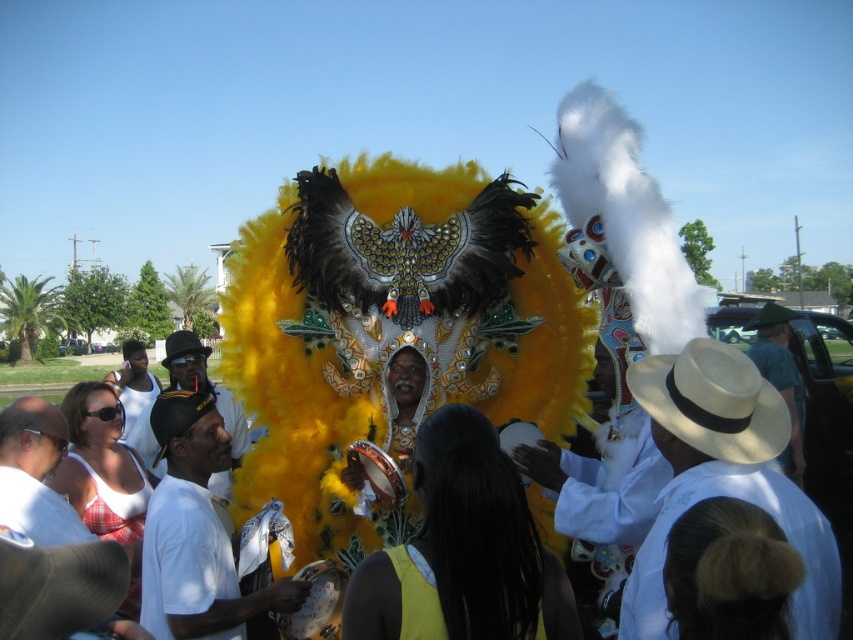
Is white straw hat at lower right above white cotton shirt at lower left?

Indeed, white straw hat at lower right is positioned over white cotton shirt at lower left.

Can you confirm if white straw hat at lower right is bigger than white cotton shirt at lower left?

No.

Does point (781, 529) come farther from viewer compared to point (0, 412)?

No.

Locate an element on the screen. white straw hat at lower right is located at coordinates (724, 477).

Where is `white cotton hat at center`? The width and height of the screenshot is (853, 640). white cotton hat at center is located at coordinates point(204,385).

Between white cotton hat at center and yellow matte dress at center, which one has less height?

Standing shorter between the two is yellow matte dress at center.

Identify the location of white cotton hat at center. (204, 385).

Where is `white straw hat at center`? The image size is (853, 640). white straw hat at center is located at coordinates (780, 378).

Which is in front, point (790, 400) or point (440, 614)?

Point (440, 614) is in front.

Who is more forward, (795, 317) or (418, 611)?

Point (418, 611)

I want to click on white straw hat at center, so pyautogui.click(x=780, y=378).